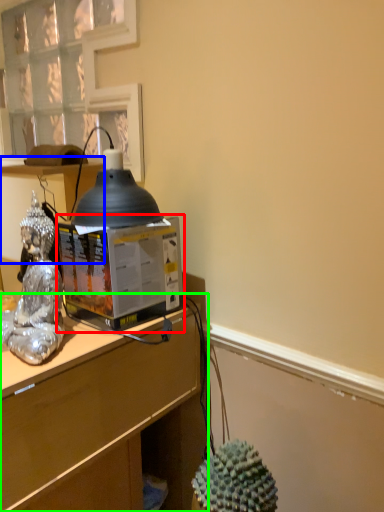
Question: Which object is positioned closest to desktop computer (highlighted by a red box)? Select from vanity (highlighted by a blue box) and desk (highlighted by a green box).

Choices:
 (A) vanity
 (B) desk

Answer: (B)